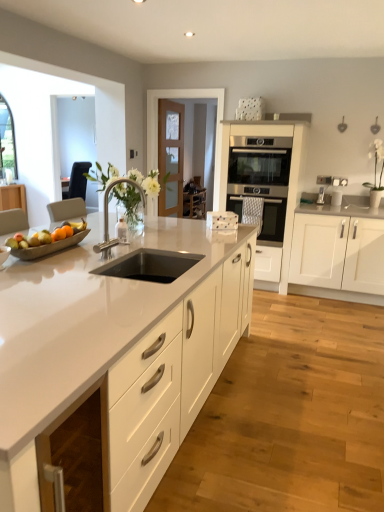
Where is `vacant point to the right of matte gray tray at left`? The width and height of the screenshot is (384, 512). vacant point to the right of matte gray tray at left is located at coordinates (95, 255).